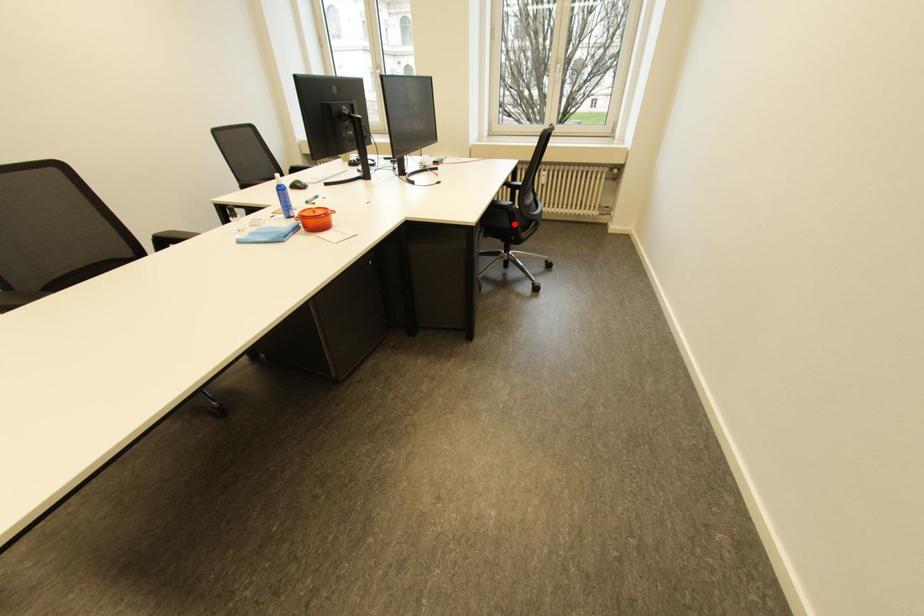
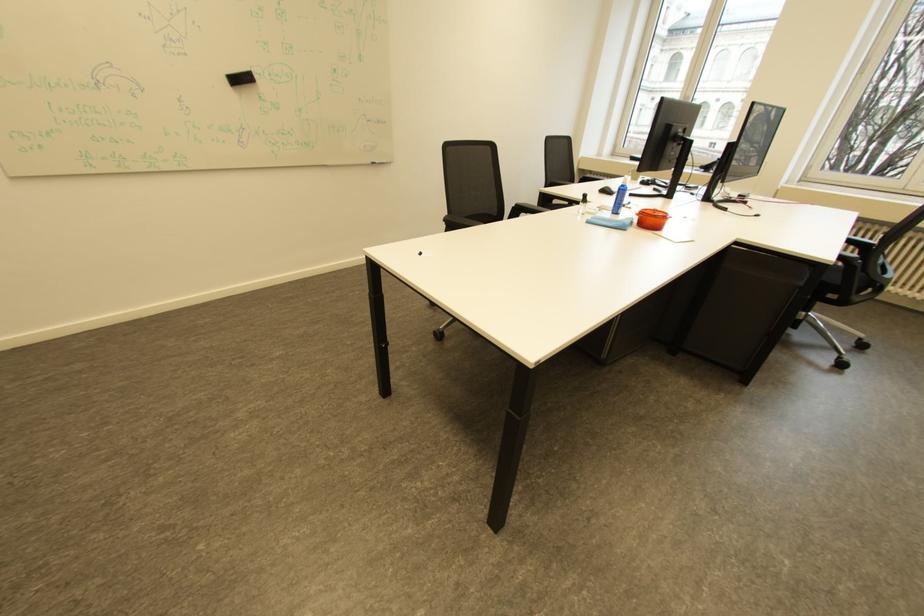
Question: A red point is marked in image1. In image2, is the corresponding 3D point closer to the camera or farther? Reply with the corresponding letter.

Choices:
 (A) The corresponding 3D point is closer.
 (B) The corresponding 3D point is farther.

Answer: (B)